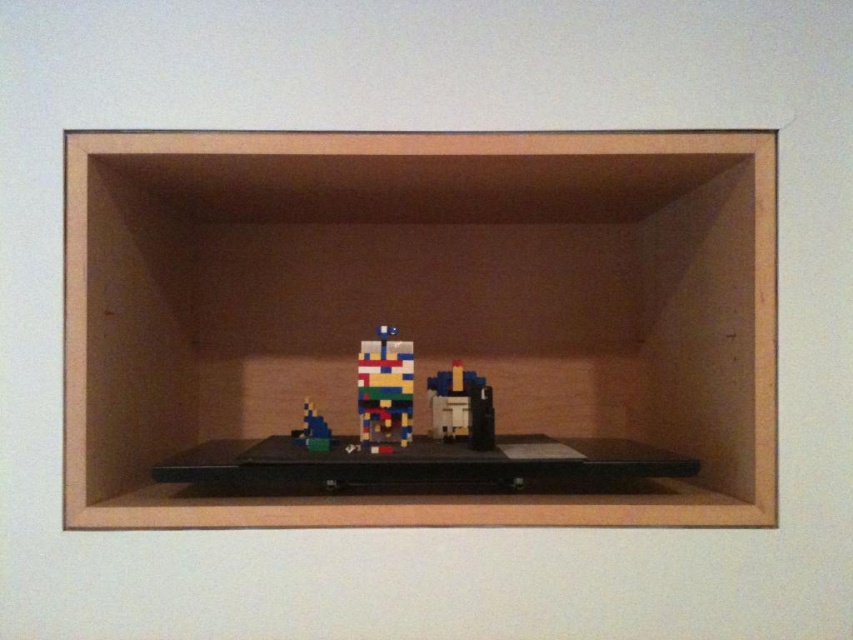
Question: Which point appears farthest from the camera in this image?

Choices:
 (A) (306, 416)
 (B) (469, 428)
 (C) (381, 412)

Answer: (B)

Question: Does matte plastic toy at center lie behind pixelated blue toy at center?

Choices:
 (A) no
 (B) yes

Answer: (A)

Question: Which point appears farthest from the camera in this image?

Choices:
 (A) (312, 428)
 (B) (318, 244)
 (C) (384, 435)
 (D) (473, 445)

Answer: (B)

Question: Does multicolored plastic toy at center appear on the left side of pixelated blue toy at center?

Choices:
 (A) yes
 (B) no

Answer: (B)

Question: Estimate the real-world distances between objects in this image. Which object is farther from the matte plastic toy at center?

Choices:
 (A) wooden shelf at center
 (B) multicolored plastic toy at center

Answer: (A)

Question: Is wooden shelf at center positioned before pixelated blue toy at center?

Choices:
 (A) yes
 (B) no

Answer: (A)